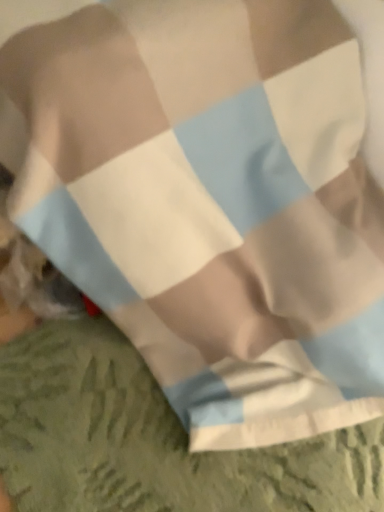
The image size is (384, 512). I want to click on light blue cotton blanket at center, so click(151, 439).

Describe the element at coordinates (151, 439) in the screenshot. I see `light blue cotton blanket at center` at that location.

Where is `light blue cotton blanket at center`? The width and height of the screenshot is (384, 512). light blue cotton blanket at center is located at coordinates (151, 439).